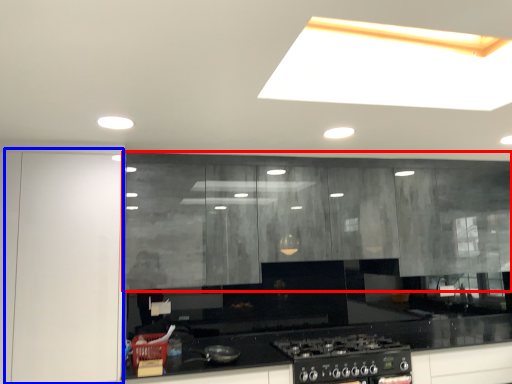
Question: Which object is closer to the camera taking this photo, cabinetry (highlighted by a red box) or glass door (highlighted by a blue box)?

Choices:
 (A) cabinetry
 (B) glass door

Answer: (B)